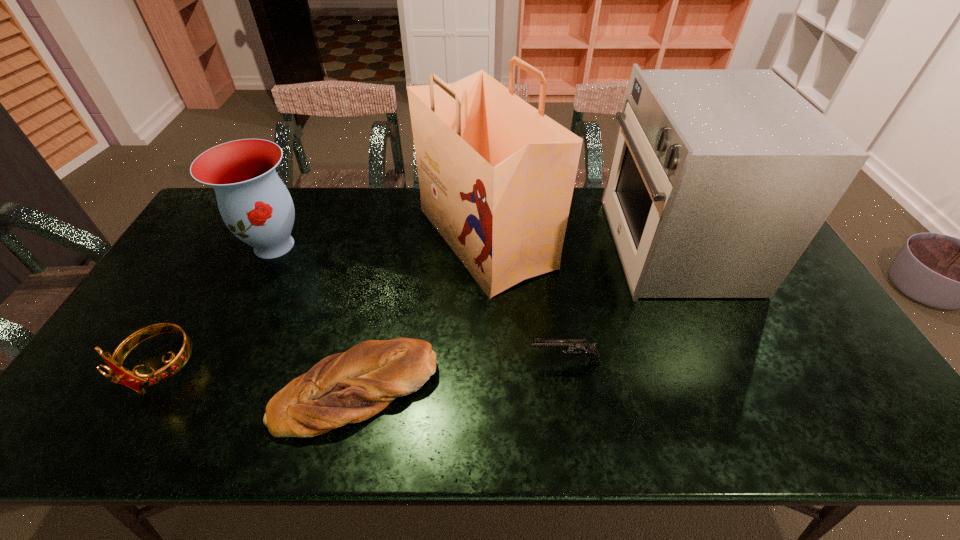
The height and width of the screenshot is (540, 960). What are the coordinates of `blank region between the fourth tallest object and the bread` in the screenshot? It's located at (258, 380).

The width and height of the screenshot is (960, 540). In order to click on empty space that is in between the third shortest object and the grocery bag in this screenshot , I will do `click(324, 303)`.

The width and height of the screenshot is (960, 540). In order to click on free space between the grocery bag and the toaster oven in this screenshot , I will do `click(579, 242)`.

Find the location of a particular element. The height and width of the screenshot is (540, 960). vacant area that lies between the fourth shortest object and the grocery bag is located at coordinates (380, 242).

Where is `vacant space in between the shortest object and the grocery bag`? The height and width of the screenshot is (540, 960). vacant space in between the shortest object and the grocery bag is located at coordinates (421, 314).

Image resolution: width=960 pixels, height=540 pixels. I want to click on free space between the tiara and the third tallest object, so click(x=218, y=307).

At what (x,y) coordinates should I click in order to perform the action: click on vacant space in between the shortest object and the tiara. Please return your answer as a coordinate pair (x, y). Looking at the image, I should click on (258, 380).

Identify the location of free space between the bread and the fourth tallest object. This screenshot has height=540, width=960. (258, 380).

In order to click on object that can be found as the fourth closest to the grocery bag in this screenshot , I will do `click(256, 206)`.

Point out which object is positioned as the nearest to the third tallest object. Please provide its 2D coordinates. Your answer should be formatted as a tuple, i.e. [(x, y)], where the tuple contains the x and y coordinates of a point satisfying the conditions above.

[(119, 374)]